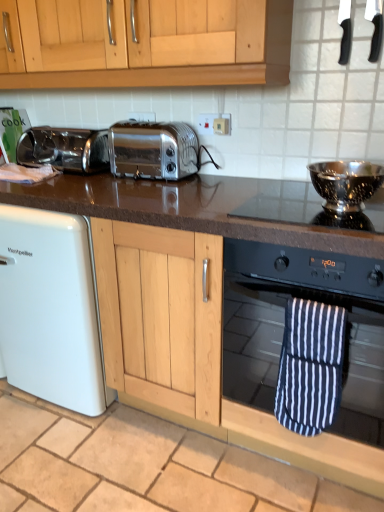
Measure the distance between white matte dishwasher at lower left and camera.

They are 4.71 feet apart.

Identify the location of white plastic electric outlet at upper center. (214, 124).

What do you see at coordinates (214, 124) in the screenshot? Image resolution: width=384 pixels, height=512 pixels. I see `white plastic electric outlet at upper center` at bounding box center [214, 124].

Measure the distance between black glass oven at center and camera.

black glass oven at center and camera are 3.47 feet apart.

What do you see at coordinates (283, 324) in the screenshot?
I see `black glass oven at center` at bounding box center [283, 324].

What do you see at coordinates (144, 466) in the screenshot? The image size is (384, 512). I see `beige tile at lower center` at bounding box center [144, 466].

Describe the element at coordinates (200, 300) in the screenshot. I see `black granite countertop at center` at that location.

Locate an element on the screen. The image size is (384, 512). white matte dishwasher at lower left is located at coordinates (51, 309).

Is black plastic knife at upper right, the first appliance from the top, looking in the opposite direction of black plastic knife at upper right, positioned as the second appliance in top-to-bottom order?

That's not correct — black plastic knife at upper right, the first appliance from the top, is not looking away from black plastic knife at upper right, positioned as the second appliance in top-to-bottom order.

From the picture: Is black plastic knife at upper right, the first appliance from the top, further to the viewer compared to black plastic knife at upper right, positioned as the second appliance in top-to-bottom order?

That is True.

Considering the sizes of objects black plastic knife at upper right, placed as the third appliance when sorted from bottom to top, and black plastic knife at upper right, the second appliance ordered from the bottom, in the image provided, who is wider, black plastic knife at upper right, placed as the third appliance when sorted from bottom to top, or black plastic knife at upper right, the second appliance ordered from the bottom,?

black plastic knife at upper right, the second appliance ordered from the bottom.

Does black plastic knife at upper right, placed as the third appliance when sorted from bottom to top, appear on the left side of black plastic knife at upper right, positioned as the second appliance in top-to-bottom order?

Yes.

Is white plastic electric outlet at upper center with polished stainless steel bowl at upper right?

They are not placed beside each other.

From a real-world perspective, is white plastic electric outlet at upper center on polished stainless steel bowl at upper right?

Yes, from a real-world perspective, white plastic electric outlet at upper center is above polished stainless steel bowl at upper right.

Is white plastic electric outlet at upper center in front of polished stainless steel bowl at upper right?

No, white plastic electric outlet at upper center is further to the viewer.

This screenshot has height=512, width=384. In order to click on electric outlet that appears on the left of polished stainless steel bowl at upper right in this screenshot , I will do `click(214, 124)`.

From the picture: Is black glass oven at center aimed at black plastic knife at upper right, the first appliance from the top?

No, black glass oven at center does not turn towards black plastic knife at upper right, the first appliance from the top.

Is black glass oven at center to the right of black plastic knife at upper right, the first appliance from the top, from the viewer's perspective?

No.

Can you confirm if black glass oven at center is bigger than black plastic knife at upper right, the first appliance from the top?

Yes.

Based on the photo, is beige tile at lower center looking in the opposite direction of satin chrome toaster at center, marked as the second toaster in a right-to-left arrangement?

No, beige tile at lower center is not facing the opposite direction of satin chrome toaster at center, marked as the second toaster in a right-to-left arrangement.

Based on their positions, is beige tile at lower center located to the left or right of satin chrome toaster at center, marked as the second toaster in a right-to-left arrangement?

Based on their positions, beige tile at lower center is located to the right of satin chrome toaster at center, marked as the second toaster in a right-to-left arrangement.

In the scene shown: Considering the sizes of objects beige tile at lower center and satin chrome toaster at center, marked as the second toaster in a right-to-left arrangement, in the image provided, who is thinner, beige tile at lower center or satin chrome toaster at center, marked as the second toaster in a right-to-left arrangement,?

satin chrome toaster at center, marked as the second toaster in a right-to-left arrangement, is thinner.

Which is less distant, [169,440] or [107,158]?

The point [169,440] is more forward.

Is polished stainless steel bowl at upper right, the 1th appliance from the bottom, bigger than satin chrome toaster at center, the 1th toaster viewed from the left?

Actually, polished stainless steel bowl at upper right, the 1th appliance from the bottom, might be smaller than satin chrome toaster at center, the 1th toaster viewed from the left.

Who is taller, polished stainless steel bowl at upper right, the 1th appliance from the bottom, or satin chrome toaster at center, marked as the second toaster in a right-to-left arrangement?

satin chrome toaster at center, marked as the second toaster in a right-to-left arrangement, is taller.

Between polished stainless steel bowl at upper right, the 3th appliance viewed from the top, and satin chrome toaster at center, marked as the second toaster in a right-to-left arrangement, which one is positioned behind?

satin chrome toaster at center, marked as the second toaster in a right-to-left arrangement, is further from the camera.

From the image's perspective, which one is positioned higher, polished stainless steel bowl at upper right, the 1th appliance from the bottom, or satin chrome toaster at center, the 1th toaster viewed from the left?

satin chrome toaster at center, the 1th toaster viewed from the left.

Locate an element on the screen. The width and height of the screenshot is (384, 512). beach towel that appears in front of the satin chrome toaster at center, the first toaster positioned from the right is located at coordinates (310, 366).

Which of these two, satin chrome toaster at center, the first toaster positioned from the right, or blue and white striped oven mitt at lower right, is smaller?

blue and white striped oven mitt at lower right is smaller.

From their relative heights in the image, would you say satin chrome toaster at center, the 2th toaster in the left-to-right sequence, is taller or shorter than blue and white striped oven mitt at lower right?

satin chrome toaster at center, the 2th toaster in the left-to-right sequence, is shorter than blue and white striped oven mitt at lower right.

What's the angular difference between satin chrome toaster at center, the 2th toaster in the left-to-right sequence, and blue and white striped oven mitt at lower right's facing directions?

There is a 0.0269-degree angle between the facing directions of satin chrome toaster at center, the 2th toaster in the left-to-right sequence, and blue and white striped oven mitt at lower right.

Starting from the black granite countertop at center, which appliance is the 2nd one behind? Please provide its 2D coordinates.

[(375, 27)]

Looking at the image, does black granite countertop at center seem bigger or smaller compared to black plastic knife at upper right, positioned as the second appliance in top-to-bottom order?

black granite countertop at center is bigger than black plastic knife at upper right, positioned as the second appliance in top-to-bottom order.

Looking at this image, from a real-world perspective, between black granite countertop at center and black plastic knife at upper right, the second appliance ordered from the bottom, who is vertically higher?

From a 3D spatial view, black plastic knife at upper right, the second appliance ordered from the bottom, is above.

From the image's perspective, is black granite countertop at center on black plastic knife at upper right, the second appliance ordered from the bottom?

No, from the image's perspective, black granite countertop at center is not on top of black plastic knife at upper right, the second appliance ordered from the bottom.

Identify the location of appliance lying above the black plastic knife at upper right, positioned as the second appliance in top-to-bottom order (from the image's perspective). The height and width of the screenshot is (512, 384). (345, 30).

Locate an element on the screen. This screenshot has height=512, width=384. gas stove located in front of the white plastic electric outlet at upper center is located at coordinates (311, 210).

From the image, which object appears to be nearer to black granite countertop at center, black plastic knife at upper right, the first appliance from the top, or polished stainless steel bowl at upper right, the 3th appliance viewed from the top?

polished stainless steel bowl at upper right, the 3th appliance viewed from the top, lies closer to black granite countertop at center than the other object.

Which object lies further to the anchor point white plastic electric outlet at upper center, polished stainless steel bowl at upper right or black plastic knife at upper right, the second appliance ordered from the bottom?

black plastic knife at upper right, the second appliance ordered from the bottom, lies further to white plastic electric outlet at upper center than the other object.

Consider the image. Looking at the image, which one is located further to white matte dishwasher at lower left, blue and white striped oven mitt at lower right or satin chrome toaster at center, marked as the second toaster in a right-to-left arrangement?

blue and white striped oven mitt at lower right is positioned further to the anchor white matte dishwasher at lower left.

Estimate the real-world distances between objects in this image. Which object is closer to polished stainless steel bowl at upper right, the 1th appliance from the bottom, satin chrome toaster at center, the first toaster positioned from the right, or blue and white striped oven mitt at lower right?

blue and white striped oven mitt at lower right is closer to polished stainless steel bowl at upper right, the 1th appliance from the bottom.

Which object lies further to the anchor point polished stainless steel bowl at upper right, white plastic electric outlet at upper center or black granite countertop at center?

black granite countertop at center is positioned further to the anchor polished stainless steel bowl at upper right.

Estimate the real-world distances between objects in this image. Which object is further from satin chrome toaster at center, the 2th toaster in the left-to-right sequence, beige tile at lower center or satin chrome toaster at center, marked as the second toaster in a right-to-left arrangement?

beige tile at lower center.

From the image, which object appears to be nearer to white plastic electric outlet at upper center, satin chrome toaster at center, the 1th toaster viewed from the left, or polished stainless steel bowl at upper right, the 1th appliance from the bottom?

polished stainless steel bowl at upper right, the 1th appliance from the bottom.

Considering their positions, is white plastic electric outlet at upper center positioned closer to blue and white striped oven mitt at lower right than beige tile at lower center?

beige tile at lower center lies closer to blue and white striped oven mitt at lower right than the other object.

Locate an element on the screen. This screenshot has width=384, height=512. countertop between white matte dishwasher at lower left and polished stainless steel bowl at upper right, the 3th appliance viewed from the top is located at coordinates (200, 300).

The height and width of the screenshot is (512, 384). In order to click on home appliance between black plastic knife at upper right, positioned as the second appliance in top-to-bottom order, and beige tile at lower center from top to bottom in this screenshot , I will do `click(51, 309)`.

Locate an element on the screen. This screenshot has width=384, height=512. gas stove between white matte dishwasher at lower left and black glass oven at center from left to right is located at coordinates (311, 210).

Where is `gas stove between black plastic knife at upper right, placed as the third appliance when sorted from bottom to top, and beige tile at lower center, in the vertical direction`? The image size is (384, 512). gas stove between black plastic knife at upper right, placed as the third appliance when sorted from bottom to top, and beige tile at lower center, in the vertical direction is located at coordinates (311, 210).